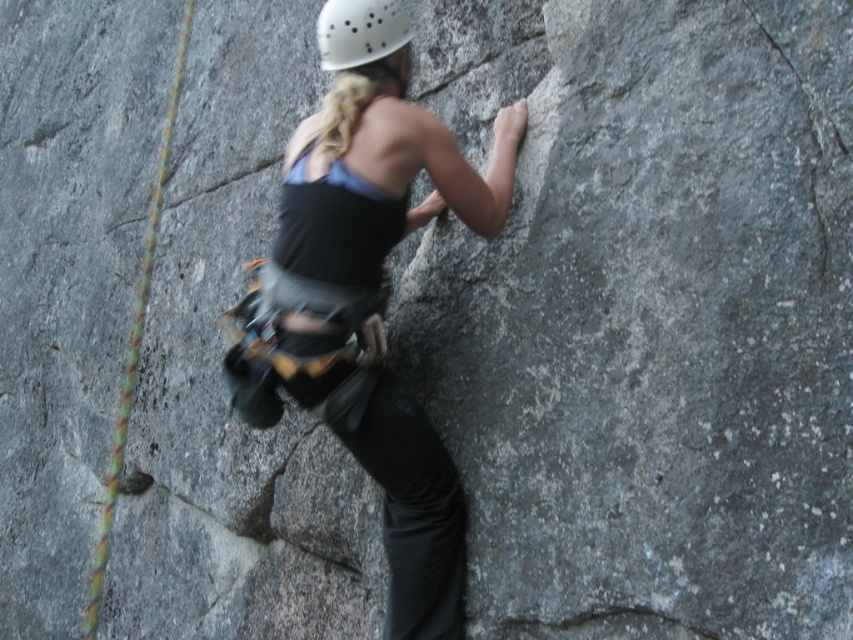
You are a photographer taking a picture of the climber. You notice the matte black tank top at center and the white matte helmet at upper center. Which object should you focus on first if you want to ensure both are in sharp focus?

The matte black tank top at center is closer to the viewer than the white matte helmet at upper center. To ensure both are in sharp focus, focus on the matte black tank top at center first since it is closer, and the helmet will fall into the depth of field range.